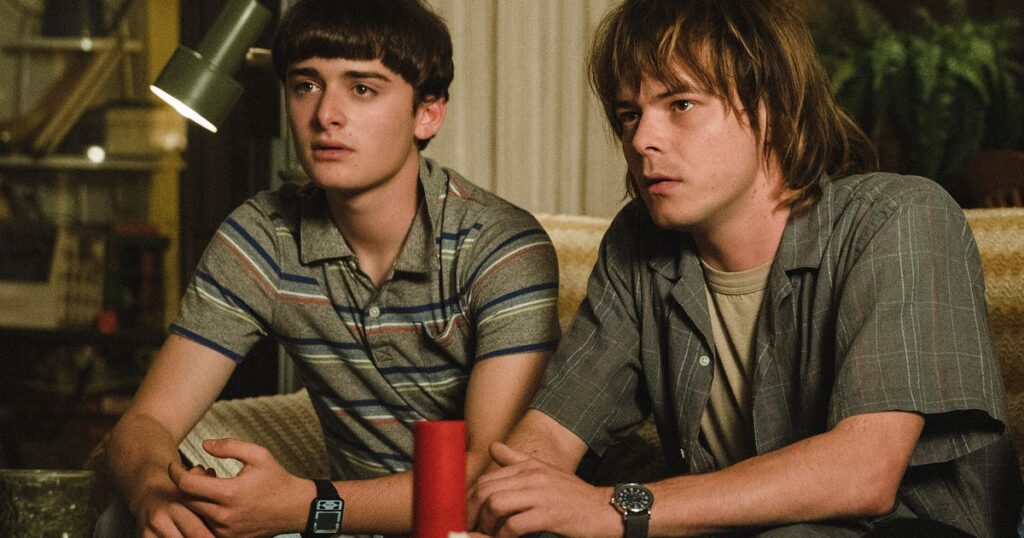
Where is `white curtains`? The height and width of the screenshot is (538, 1024). white curtains is located at coordinates (520, 118).